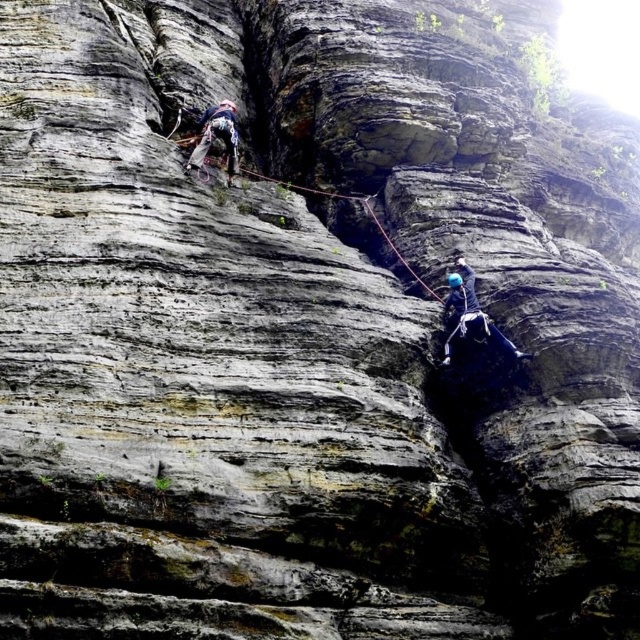
Between blue fabric climbing harness at upper left and red nylon rope at center, which one is positioned higher?

Positioned higher is blue fabric climbing harness at upper left.

Who is taller, blue fabric climbing harness at upper left or red nylon rope at center?

red nylon rope at center is taller.

Is point (202, 145) closer to viewer compared to point (371, 205)?

Yes, it is.

I want to click on blue fabric climbing harness at upper left, so click(x=216, y=136).